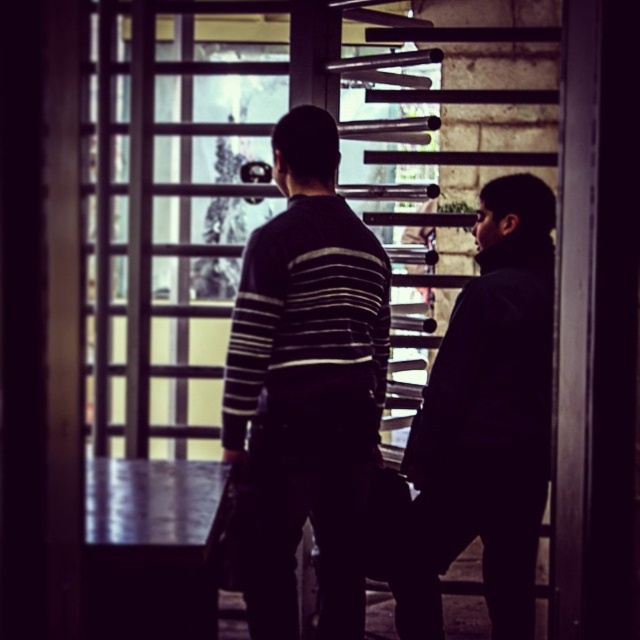
Question: Which object is closer to the camera taking this photo?

Choices:
 (A) dark matte jacket at right
 (B) striped sweater at center

Answer: (B)

Question: Can you confirm if striped sweater at center is smaller than dark matte jacket at right?

Choices:
 (A) no
 (B) yes

Answer: (A)

Question: Does striped sweater at center come in front of dark matte jacket at right?

Choices:
 (A) yes
 (B) no

Answer: (A)

Question: Does striped sweater at center have a larger size compared to dark matte jacket at right?

Choices:
 (A) no
 (B) yes

Answer: (B)

Question: Which point is farther to the camera?

Choices:
 (A) (298, 634)
 (B) (516, 252)

Answer: (B)

Question: Which point appears closest to the camera in this image?

Choices:
 (A) (477, 432)
 (B) (273, 588)

Answer: (B)